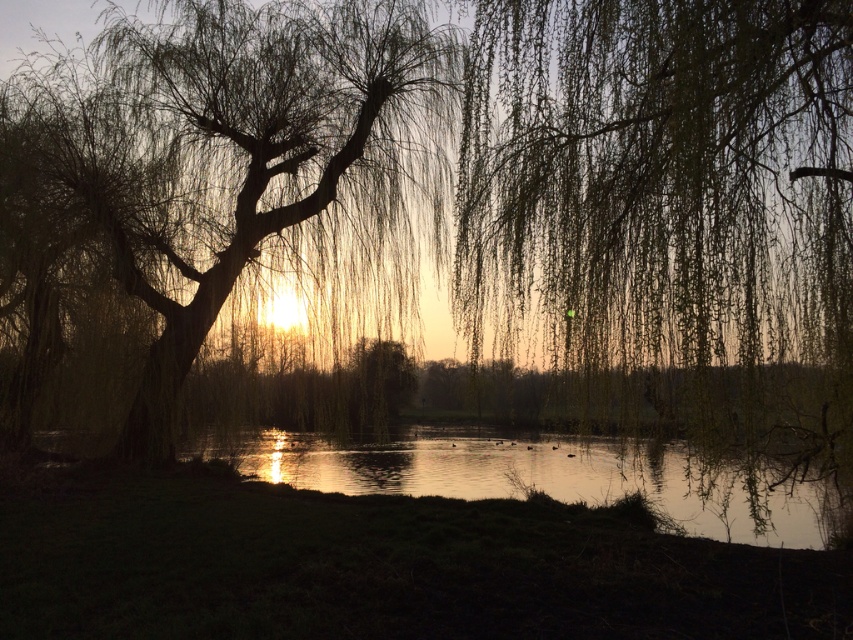
Is green leafy willow at center smaller than silvery branches willow at center?

Indeed, green leafy willow at center has a smaller size compared to silvery branches willow at center.

Is point (747, 26) positioned in front of point (412, 92)?

Yes, it is in front of point (412, 92).

Where is `green leafy willow at center`? Image resolution: width=853 pixels, height=640 pixels. green leafy willow at center is located at coordinates (663, 184).

Identify the location of green leafy willow at center. (663, 184).